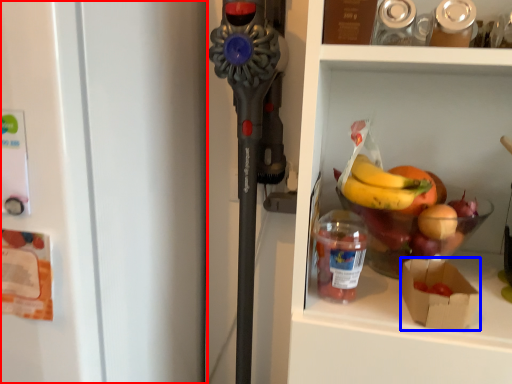
Question: Which object appears farthest to the camera in this image, refrigerator (highlighted by a red box) or box (highlighted by a blue box)?

Choices:
 (A) refrigerator
 (B) box

Answer: (B)